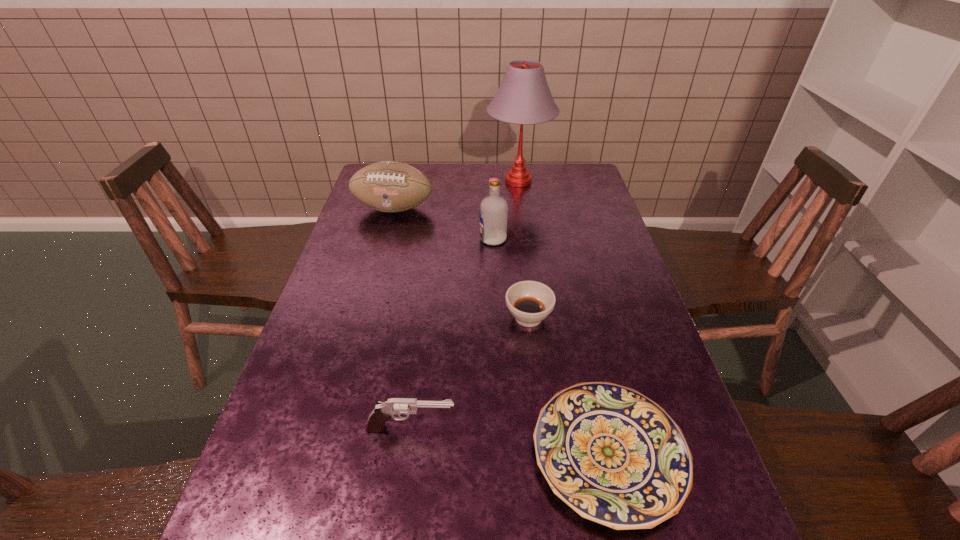
You are a GUI agent. You are given a task and a screenshot of the screen. Output one action in this format:
    pyautogui.click(x=<x>, y=<y>)
    Task: Click on the free point between the tallest object and the gun
    
    Given the screenshot: What is the action you would take?
    pyautogui.click(x=465, y=305)

Find the location of a particular element. The image size is (960, 540). vacant region between the plate and the soup bowl is located at coordinates (x=568, y=386).

The image size is (960, 540). I want to click on free point between the gun and the fifth shortest object, so click(x=452, y=334).

Where is `free space between the fourth shortest object and the tallest object`? This screenshot has height=540, width=960. free space between the fourth shortest object and the tallest object is located at coordinates (456, 195).

This screenshot has height=540, width=960. Identify the location of object that is the fifth closest one to the tallest object. (384, 411).

Image resolution: width=960 pixels, height=540 pixels. What are the coordinates of `object identified as the fifth closest to the gun` in the screenshot? It's located at (524, 97).

Where is `vacant space that satisfies the following two spatial constraints: 1. on the front-facing side of the tallest object; 2. on the left side of the plate`? vacant space that satisfies the following two spatial constraints: 1. on the front-facing side of the tallest object; 2. on the left side of the plate is located at coordinates (555, 454).

Where is `free spot that satisfies the following two spatial constraints: 1. on the back side of the shortest object; 2. on the label of the fifth shortest object`? free spot that satisfies the following two spatial constraints: 1. on the back side of the shortest object; 2. on the label of the fifth shortest object is located at coordinates (560, 239).

Find the location of a particular element. free spot that satisfies the following two spatial constraints: 1. on the label of the vodka; 2. on the left side of the plate is located at coordinates (501, 454).

Where is `vacant space that satisfies the following two spatial constraints: 1. on the front side of the shortest object; 2. on the right side of the soup bowl`? Image resolution: width=960 pixels, height=540 pixels. vacant space that satisfies the following two spatial constraints: 1. on the front side of the shortest object; 2. on the right side of the soup bowl is located at coordinates (544, 454).